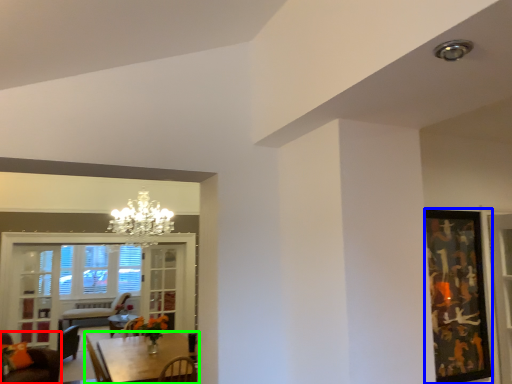
Question: Which is farther away from chair (highlighted by a red box)? picture frame (highlighted by a blue box) or table (highlighted by a green box)?

Choices:
 (A) picture frame
 (B) table

Answer: (A)